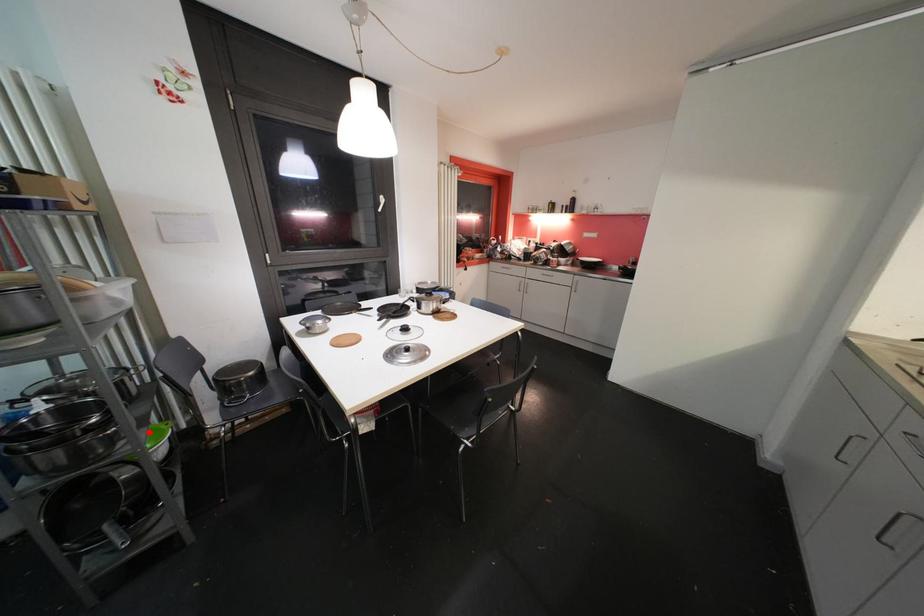
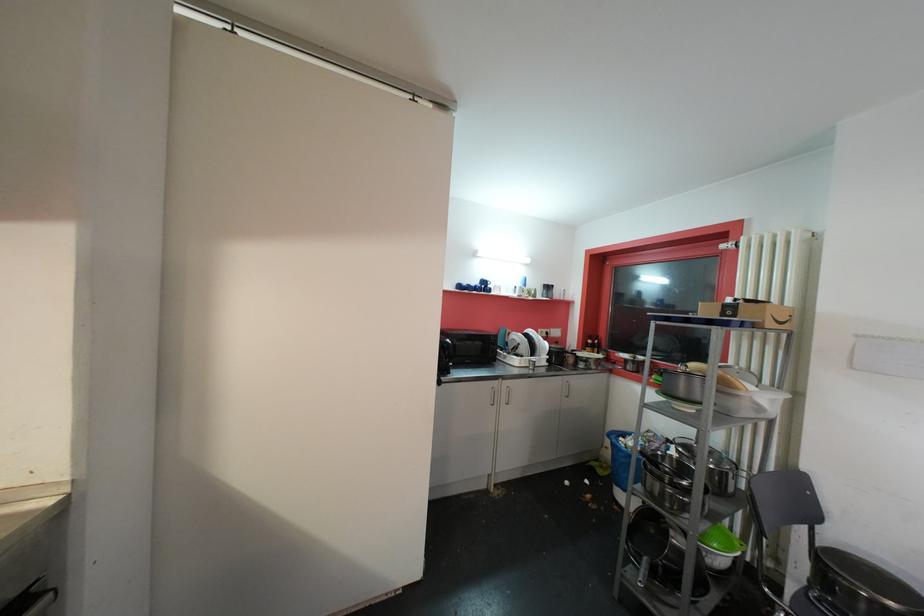
Question: A red point is marked in image1. In image2, is the corresponding 3D point closer to the camera or farther? Reply with the corresponding letter.

Choices:
 (A) The corresponding 3D point is closer.
 (B) The corresponding 3D point is farther.

Answer: (A)